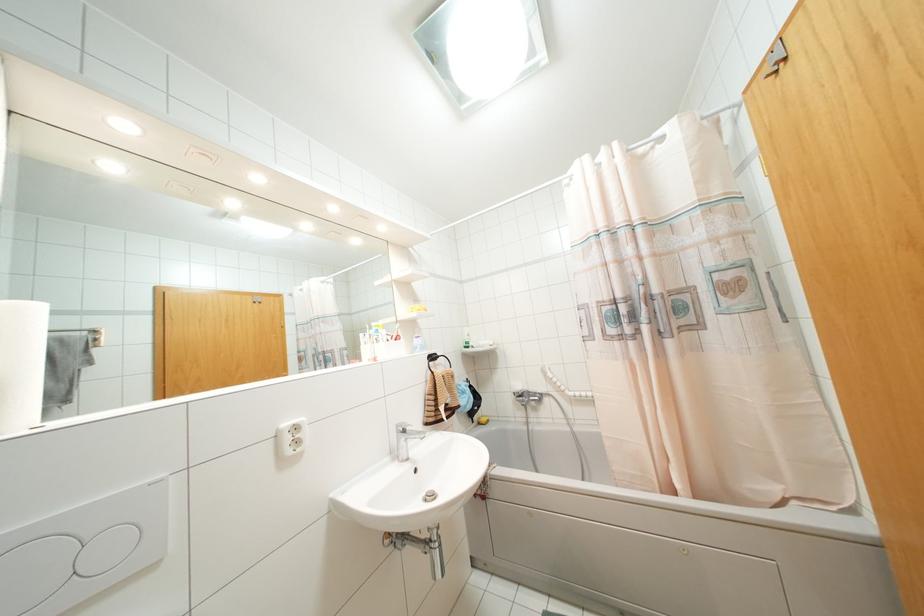
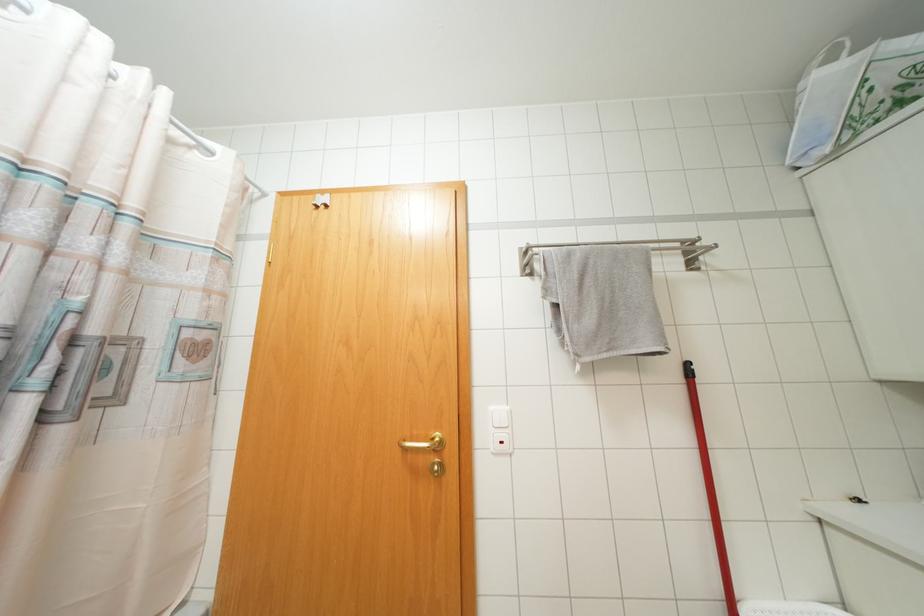
Looking at this image, first-person continuous shooting, in which direction is the camera rotating?

The camera's rotation is toward right-up.